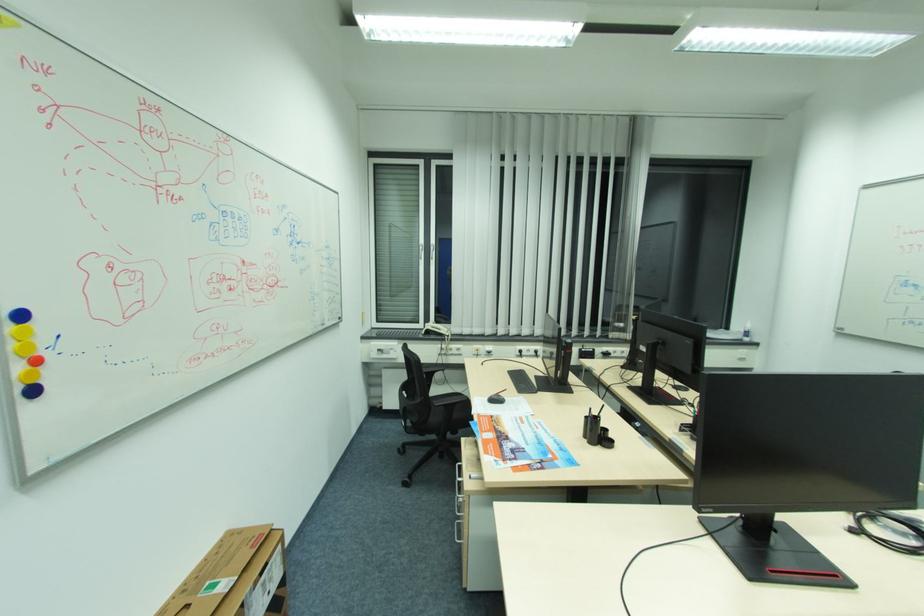
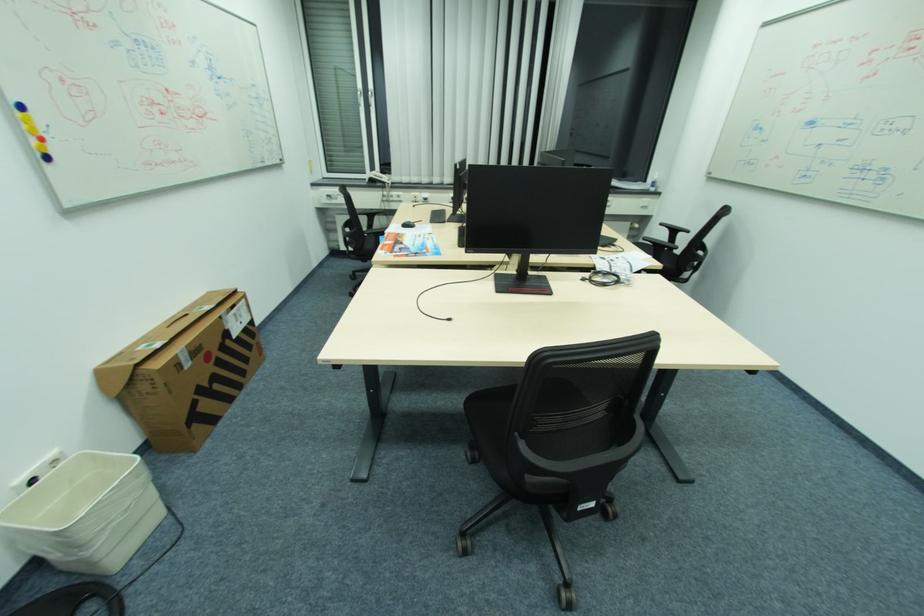
The point at (x=423, y=323) is marked in the first image. Where is the corresponding point in the second image?

(370, 174)